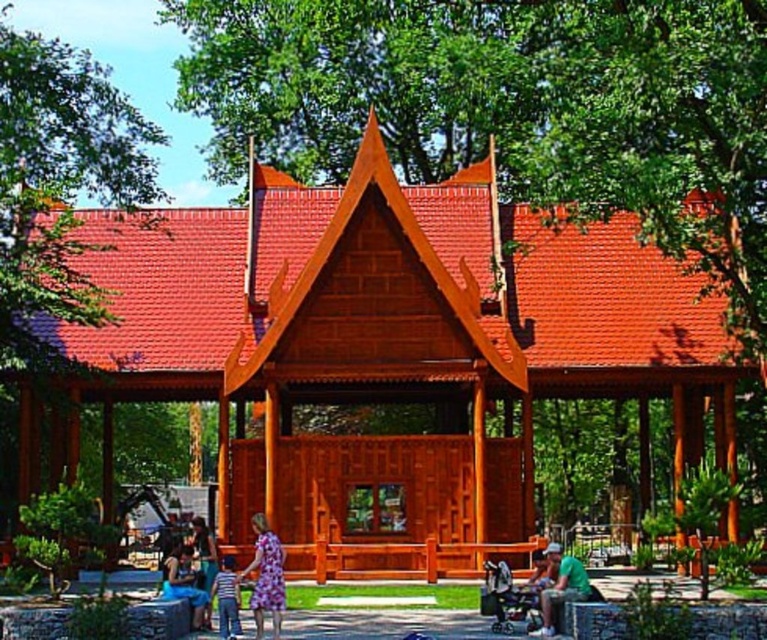
Question: Which object is the closest to the green matte shirt at lower right?

Choices:
 (A) floral dress at center
 (B) matte blue dress at lower center
 (C) green leafy tree at left

Answer: (A)

Question: Can you confirm if green leafy tree at center is thinner than floral dress at center?

Choices:
 (A) no
 (B) yes

Answer: (A)

Question: Which object appears farthest from the camera in this image?

Choices:
 (A) floral dress at center
 (B) striped shirt at lower center
 (C) green leafy tree at left

Answer: (C)

Question: Does shiny wood gazebo at center appear on the right side of green leafy tree at left?

Choices:
 (A) yes
 (B) no

Answer: (A)

Question: Can you confirm if green leafy tree at center is smaller than green leafy tree at left?

Choices:
 (A) no
 (B) yes

Answer: (B)

Question: Considering the real-world distances, which object is farthest from the matte blue dress at lower center?

Choices:
 (A) green matte shirt at lower right
 (B) shiny wood gazebo at center

Answer: (B)